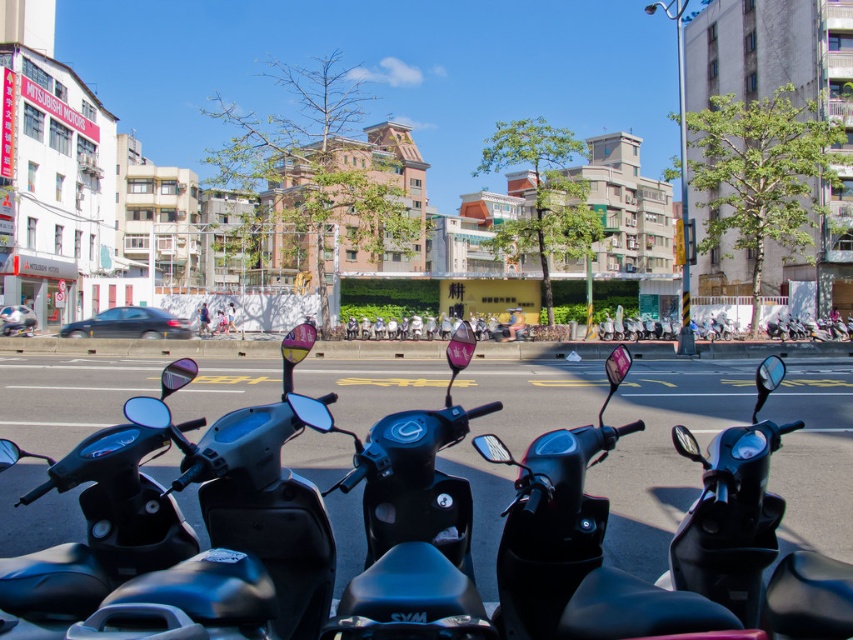
Is matte black motorbike at center bigger than black matte scooter at center?

Actually, matte black motorbike at center might be smaller than black matte scooter at center.

Which is in front, point (444, 576) or point (758, 371)?

Point (444, 576) is in front.

At what (x,y) coordinates should I click in order to perform the action: click on matte black motorbike at center. Please return your answer as a coordinate pair (x, y). Looking at the image, I should click on [x=405, y=531].

Locate an element on the screen. This screenshot has width=853, height=640. matte black motorbike at center is located at coordinates (405, 531).